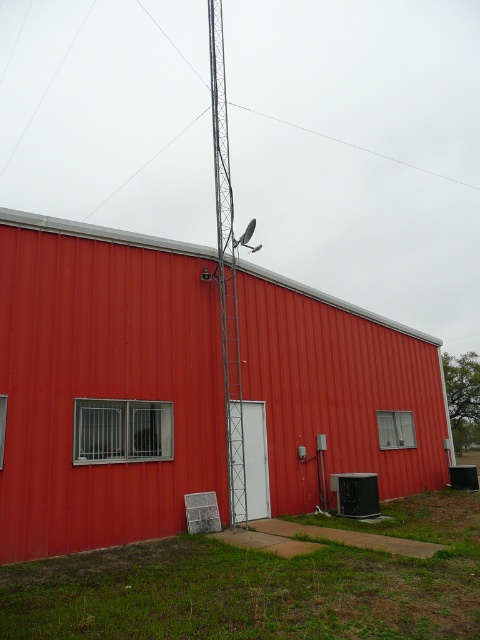
Does metallic red barn at center have a lesser height compared to metallic silver antenna at center?

Correct, metallic red barn at center is not as tall as metallic silver antenna at center.

Between metallic red barn at center and metallic silver antenna at center, which one is positioned higher?

metallic silver antenna at center

Who is more distant from viewer, (x=277, y=342) or (x=216, y=65)?

The point (x=216, y=65) is behind.

This screenshot has height=640, width=480. Find the location of `metallic red barn at center`. metallic red barn at center is located at coordinates (105, 385).